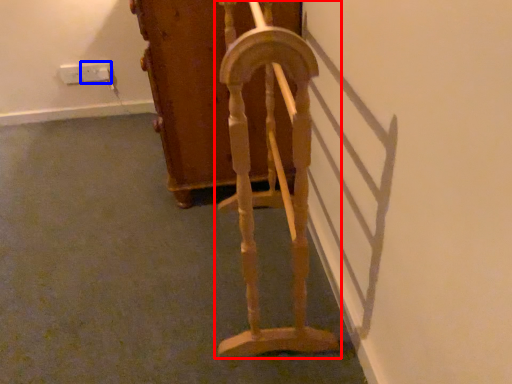
Question: Which of the following is the closest to the observer, furniture (highlighted by a red box) or electric outlet (highlighted by a blue box)?

Choices:
 (A) furniture
 (B) electric outlet

Answer: (A)